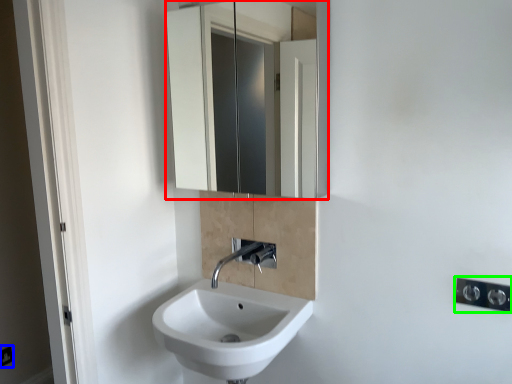
Question: Which object is the closest to the mirror (highlighted by a red box)? Choose among these: electric outlet (highlighted by a blue box) or light switch (highlighted by a green box).

Choices:
 (A) electric outlet
 (B) light switch

Answer: (A)